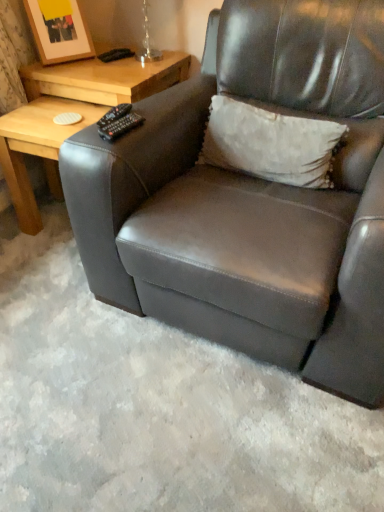
Identify the location of free space in front of wooden picture frame at upper left. Image resolution: width=384 pixels, height=512 pixels. (66, 72).